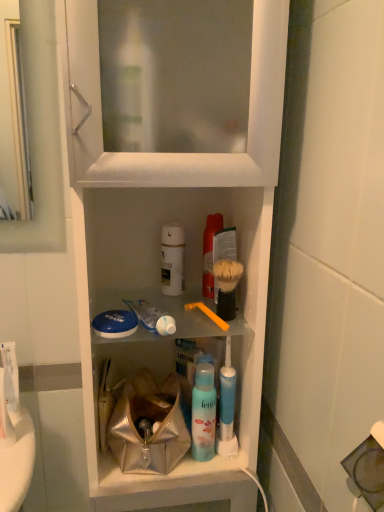
You are a GUI agent. You are given a task and a screenshot of the screen. Output one action in this format:
    pyautogui.click(x=<x>, y=<y>)
    Task: Click on the white plastic cabinet at center
    This screenshot has width=384, height=512.
    Given the screenshot: What is the action you would take?
    pyautogui.click(x=159, y=244)

The height and width of the screenshot is (512, 384). Describe the element at coordinates (207, 314) in the screenshot. I see `orange plastic toothbrush at center` at that location.

What do you see at coordinates (210, 253) in the screenshot? The height and width of the screenshot is (512, 384). I see `translucent plastic mouthwash at center, the 1th mouthwash positioned from the top` at bounding box center [210, 253].

This screenshot has width=384, height=512. What are the coordinates of `white plastic cabinet at center` in the screenshot? It's located at (159, 244).

Is the depth of white glossy toothpaste at center greater than that of white plastic cabinet at center?

That is True.

From the image's perspective, is white glossy toothpaste at center on top of white plastic cabinet at center?

Indeed, from the image's perspective, white glossy toothpaste at center is shown above white plastic cabinet at center.

I want to click on cabinetry located in front of the white glossy toothpaste at center, so click(159, 244).

Between orange plastic toothbrush at center and white glossy toothpaste at center, which one is positioned behind?

orange plastic toothbrush at center.

Is orange plastic toothbrush at center positioned far away from white glossy toothpaste at center?

orange plastic toothbrush at center is actually quite close to white glossy toothpaste at center.

How many degrees apart are the facing directions of orange plastic toothbrush at center and white glossy toothpaste at center?

The angle between the facing direction of orange plastic toothbrush at center and the facing direction of white glossy toothpaste at center is 3.54e-05 degrees.

Find the location of a particular element. This screenshot has width=384, height=512. toothbrush to the right of white glossy toothpaste at center is located at coordinates (207, 314).

From the white glossy toothpaste at center, count 3rd mouthwashs backward and point to it. Please provide its 2D coordinates.

[(172, 259)]

How different are the orientations of white glossy toothpaste at center and white matte bottle at center, positioned as the 2th mouthwash in top-to-bottom order, in degrees?

The facing directions of white glossy toothpaste at center and white matte bottle at center, positioned as the 2th mouthwash in top-to-bottom order, are 3.24e-05 degrees apart.

In the scene shown: Is white glossy toothpaste at center further to camera compared to white matte bottle at center, which is the 2th mouthwash in bottom-to-top order?

No, it is not.

Considering the sizes of objects white glossy toothpaste at center and white matte bottle at center, which is the 2th mouthwash in bottom-to-top order, in the image provided, who is wider, white glossy toothpaste at center or white matte bottle at center, which is the 2th mouthwash in bottom-to-top order,?

white glossy toothpaste at center is wider.

Considering the positions of point (147, 309) and point (197, 378), is point (147, 309) closer or farther from the camera than point (197, 378)?

Point (147, 309).

Is white glossy toothpaste at center facing away from blue matte mouthwash at center, placed as the first mouthwash when sorted from bottom to top?

white glossy toothpaste at center is not turned away from blue matte mouthwash at center, placed as the first mouthwash when sorted from bottom to top.

Between white glossy toothpaste at center and blue matte mouthwash at center, marked as the 3th mouthwash in a top-to-bottom arrangement, which one has smaller size?

white glossy toothpaste at center is smaller.

Which is further, (204, 288) or (159, 316)?

The point (204, 288) is more distant.

Is white glossy toothpaste at center at the back of translucent plastic mouthwash at center, arranged as the 3th mouthwash when ordered from the bottom?

No, translucent plastic mouthwash at center, arranged as the 3th mouthwash when ordered from the bottom,'s orientation is not away from white glossy toothpaste at center.

Considering the positions of objects translucent plastic mouthwash at center, arranged as the 3th mouthwash when ordered from the bottom, and white glossy toothpaste at center in the image provided, who is more to the left, translucent plastic mouthwash at center, arranged as the 3th mouthwash when ordered from the bottom, or white glossy toothpaste at center?

From the viewer's perspective, white glossy toothpaste at center appears more on the left side.

Can you confirm if translucent plastic mouthwash at center, the 1th mouthwash positioned from the top, is shorter than white glossy toothpaste at center?

No.

What's the angular difference between blue matte mouthwash at center, marked as the 3th mouthwash in a top-to-bottom arrangement, and white plastic cabinet at center's facing directions?

There is a 0.204-degree angle between the facing directions of blue matte mouthwash at center, marked as the 3th mouthwash in a top-to-bottom arrangement, and white plastic cabinet at center.

In the image, is blue matte mouthwash at center, placed as the first mouthwash when sorted from bottom to top, positioned in front of or behind white plastic cabinet at center?

Clearly, blue matte mouthwash at center, placed as the first mouthwash when sorted from bottom to top, is behind white plastic cabinet at center.

Is blue matte mouthwash at center, placed as the first mouthwash when sorted from bottom to top, looking in the opposite direction of white plastic cabinet at center?

Yes.

Considering the relative sizes of white plastic cabinet at center and blue matte mouthwash at center, marked as the 3th mouthwash in a top-to-bottom arrangement, in the image provided, is white plastic cabinet at center smaller than blue matte mouthwash at center, marked as the 3th mouthwash in a top-to-bottom arrangement,?

Actually, white plastic cabinet at center might be larger than blue matte mouthwash at center, marked as the 3th mouthwash in a top-to-bottom arrangement.

Considering the sizes of objects white plastic cabinet at center and blue matte mouthwash at center, marked as the 3th mouthwash in a top-to-bottom arrangement, in the image provided, who is taller, white plastic cabinet at center or blue matte mouthwash at center, marked as the 3th mouthwash in a top-to-bottom arrangement,?

With more height is white plastic cabinet at center.

Which object is positioned more to the left, white plastic cabinet at center or blue matte mouthwash at center, placed as the first mouthwash when sorted from bottom to top?

white plastic cabinet at center.

I want to click on toothpaste above the white plastic cabinet at center (from the image's perspective), so click(152, 317).

The height and width of the screenshot is (512, 384). What are the coordinates of `toothpaste that is below the orange plastic toothbrush at center (from the image's perspective)` in the screenshot? It's located at (152, 317).

Based on their spatial positions, is white matte bottle at center, positioned as the 2th mouthwash in top-to-bottom order, or white plastic cabinet at center further from orange plastic toothbrush at center?

white plastic cabinet at center is positioned further to the anchor orange plastic toothbrush at center.

Considering their positions, is metallic silver bag at center positioned closer to translucent plastic mouthwash at center, arranged as the 3th mouthwash when ordered from the bottom, than blue matte mouthwash at center, marked as the 3th mouthwash in a top-to-bottom arrangement?

blue matte mouthwash at center, marked as the 3th mouthwash in a top-to-bottom arrangement, is closer to translucent plastic mouthwash at center, arranged as the 3th mouthwash when ordered from the bottom.

Which object lies further to the anchor point white matte bottle at center, which is the 2th mouthwash in bottom-to-top order, orange plastic toothbrush at center or white plastic cabinet at center?

Based on the image, white plastic cabinet at center appears to be further to white matte bottle at center, which is the 2th mouthwash in bottom-to-top order.

Which object lies nearer to the anchor point blue matte mouthwash at center, marked as the 3th mouthwash in a top-to-bottom arrangement, white glossy toothpaste at center or orange plastic toothbrush at center?

orange plastic toothbrush at center.

Based on their spatial positions, is translucent plastic mouthwash at center, the 1th mouthwash positioned from the top, or metallic silver bag at center further from white matte bottle at center, positioned as the 2th mouthwash in top-to-bottom order?

metallic silver bag at center lies further to white matte bottle at center, positioned as the 2th mouthwash in top-to-bottom order, than the other object.

From the image, which object appears to be nearer to metallic silver bag at center, white matte bottle at center, which is the 2th mouthwash in bottom-to-top order, or blue matte mouthwash at center, placed as the first mouthwash when sorted from bottom to top?

Based on the image, blue matte mouthwash at center, placed as the first mouthwash when sorted from bottom to top, appears to be nearer to metallic silver bag at center.

Estimate the real-world distances between objects in this image. Which object is closer to white plastic cabinet at center, blue matte mouthwash at center, marked as the 3th mouthwash in a top-to-bottom arrangement, or white matte bottle at center, positioned as the 2th mouthwash in top-to-bottom order?

white matte bottle at center, positioned as the 2th mouthwash in top-to-bottom order.

Estimate the real-world distances between objects in this image. Which object is further from white plastic cabinet at center, orange plastic toothbrush at center or blue matte mouthwash at center, placed as the first mouthwash when sorted from bottom to top?

Based on the image, blue matte mouthwash at center, placed as the first mouthwash when sorted from bottom to top, appears to be further to white plastic cabinet at center.

This screenshot has width=384, height=512. Identify the location of toothpaste between white matte bottle at center, positioned as the 2th mouthwash in top-to-bottom order, and blue matte mouthwash at center, marked as the 3th mouthwash in a top-to-bottom arrangement, in the up-down direction. (152, 317).

Find the location of `toothpaste that lies between translucent plastic mouthwash at center, the 1th mouthwash positioned from the top, and metallic silver bag at center from top to bottom`. toothpaste that lies between translucent plastic mouthwash at center, the 1th mouthwash positioned from the top, and metallic silver bag at center from top to bottom is located at coordinates (152, 317).

Locate an element on the screen. bag located between white plastic cabinet at center and translucent plastic mouthwash at center, the 1th mouthwash positioned from the top, in the depth direction is located at coordinates (149, 425).

Locate an element on the screen. toothpaste between white plastic cabinet at center and orange plastic toothbrush at center in the front-back direction is located at coordinates (152, 317).